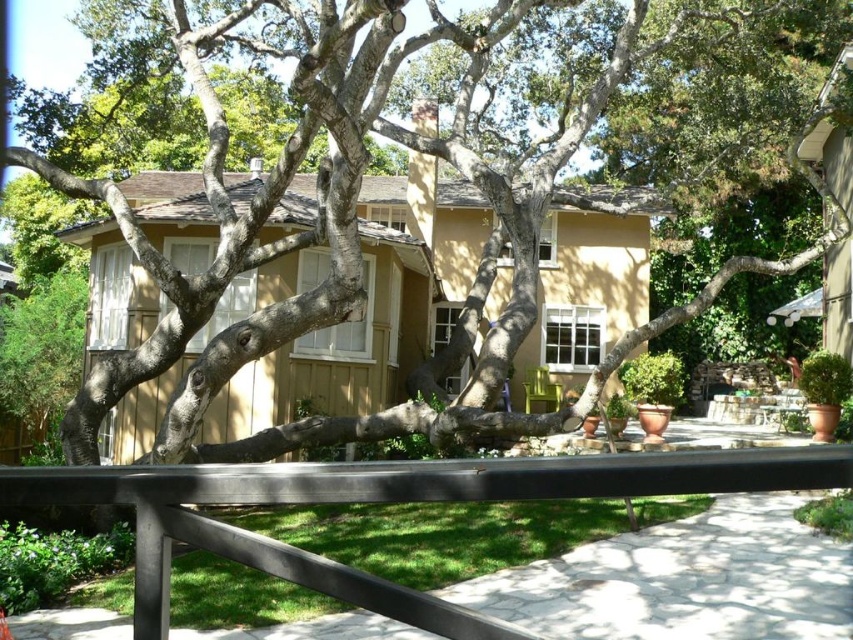
Does brown textured tree at center come behind black metal rail at center?

Yes, it is.

Is point (206, 381) closer to camera compared to point (68, 477)?

That is False.

Find the location of `brown textured tree at center`. brown textured tree at center is located at coordinates (352, 227).